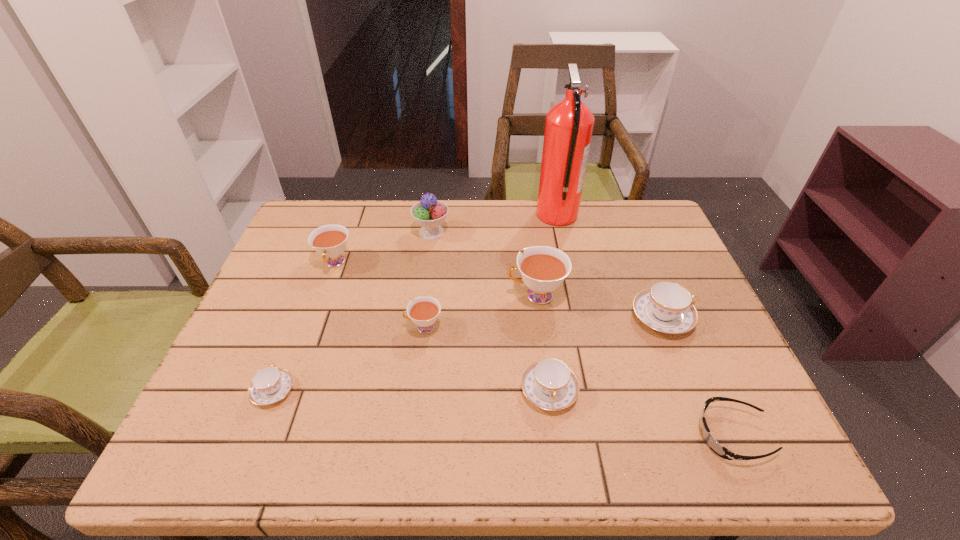
You are a GUI agent. You are given a task and a screenshot of the screen. Output one action in this format:
    pyautogui.click(x=<x>, y=<y>)
    Task: Click on the free region at the left edge
    This screenshot has height=540, width=960.
    Given the screenshot: What is the action you would take?
    pyautogui.click(x=286, y=341)

In order to click on vacant space at the right edge of the desktop in this screenshot , I will do `click(652, 270)`.

I want to click on vacant space at the far left corner of the desktop, so click(327, 210).

Where is `free space at the near left corner of the desktop`? free space at the near left corner of the desktop is located at coordinates (273, 429).

Find the location of a particular element. This screenshot has width=960, height=540. vacant region at the far right corner is located at coordinates (645, 205).

You are a GUI agent. You are given a task and a screenshot of the screen. Output one action in this format:
    pyautogui.click(x=<x>, y=<y>)
    Task: Click on the vacant region between the rightmost white teacup and the second tallest object
    The width and height of the screenshot is (960, 540).
    Given the screenshot: What is the action you would take?
    pyautogui.click(x=484, y=264)

The image size is (960, 540). I want to click on vacant area between the eighth shortest object and the second biggest blue teacup, so (491, 312).

The height and width of the screenshot is (540, 960). I want to click on vacant space that is in between the shortest object and the second white teacup from left to right, so click(x=578, y=381).

Identify the location of free space between the icecream and the fire extinguisher. (494, 224).

This screenshot has width=960, height=540. In order to click on free space that is in between the nearest white teacup and the second biggest blue teacup in this screenshot , I will do `click(487, 359)`.